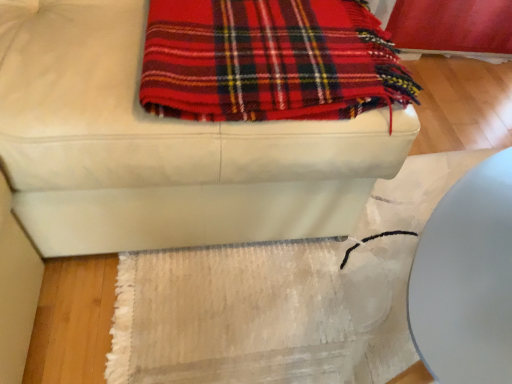
Question: From the image's perspective, is white textured mat at lower center located above or below white leather ottoman at upper center?

Choices:
 (A) below
 (B) above

Answer: (A)

Question: In terms of size, does white textured mat at lower center appear bigger or smaller than white leather ottoman at upper center?

Choices:
 (A) big
 (B) small

Answer: (B)

Question: Which object is positioned farthest from the white textured mat at lower center?

Choices:
 (A) red plaid blanket at upper center
 (B) white leather ottoman at upper center

Answer: (A)

Question: Which of these objects is positioned farthest from the white leather ottoman at upper center?

Choices:
 (A) white textured mat at lower center
 (B) red plaid blanket at upper center

Answer: (A)